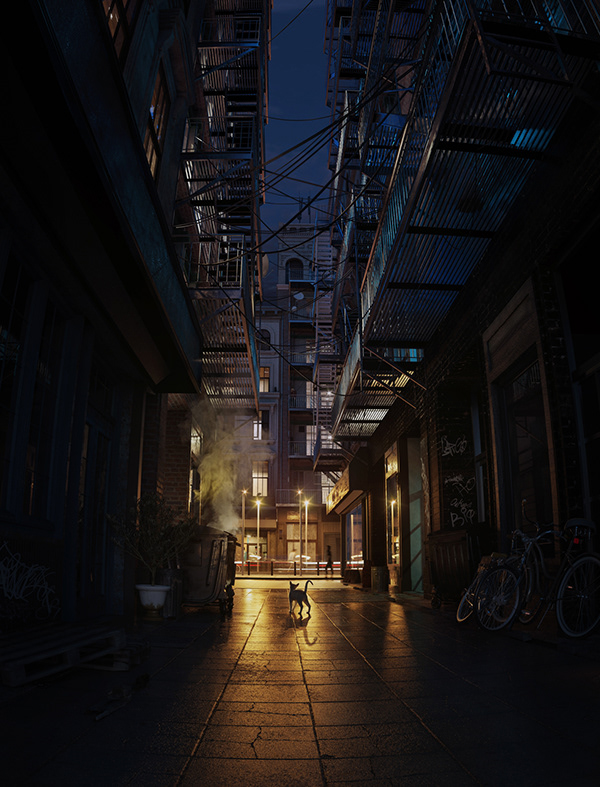
This screenshot has height=787, width=600. I want to click on flower pot, so click(139, 584).